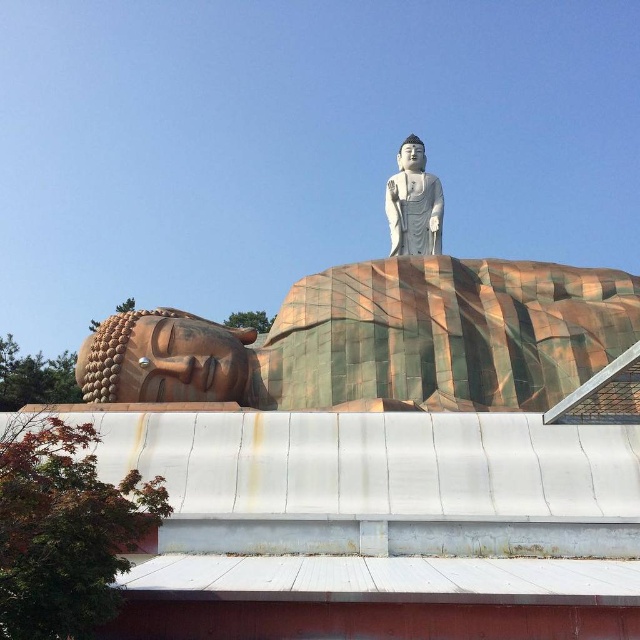
Between gold textured statue at lower left and white marble statue at upper center, which one is positioned lower?

gold textured statue at lower left is below.

How much distance is there between gold textured statue at lower left and white marble statue at upper center?

14.38 meters

You are a GUI agent. You are given a task and a screenshot of the screen. Output one action in this format:
    pyautogui.click(x=<x>, y=<y>)
    Task: Click on the gold textured statue at lower left
    
    Given the screenshot: What is the action you would take?
    pyautogui.click(x=384, y=330)